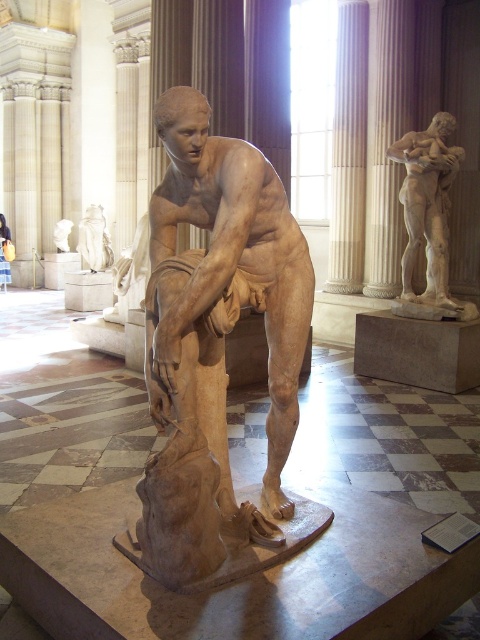
You are an art student standing in the museum and want to take a photo of the matte stone statue at center and the white marble statue at upper left. Which statue should you focus on first to ensure both are in the frame?

You should focus on the matte stone statue at center first because it is in front of the white marble statue at upper left, so adjusting the camera to include both would require framing starting from the closer object.

You are standing in a museum and want to take a photo of the white marble column at center. If your camera can focus on objects up to 15 meters away, will you be able to take a clear photo from your current position?

The white marble column at center is 14.82 meters away from the viewer. Since the camera can focus up to 15 meters, you can take a clear photo from your current position.